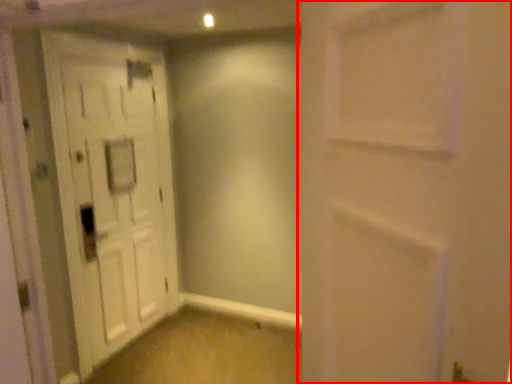
Question: Considering the relative positions of door (annotated by the red box) and door in the image provided, where is door (annotated by the red box) located with respect to the staircase?

Choices:
 (A) right
 (B) left

Answer: (A)